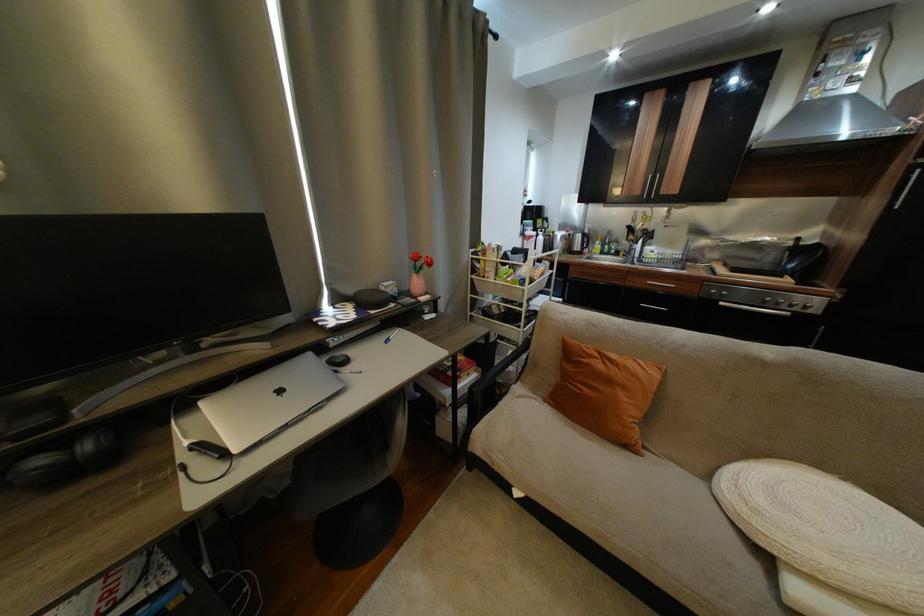
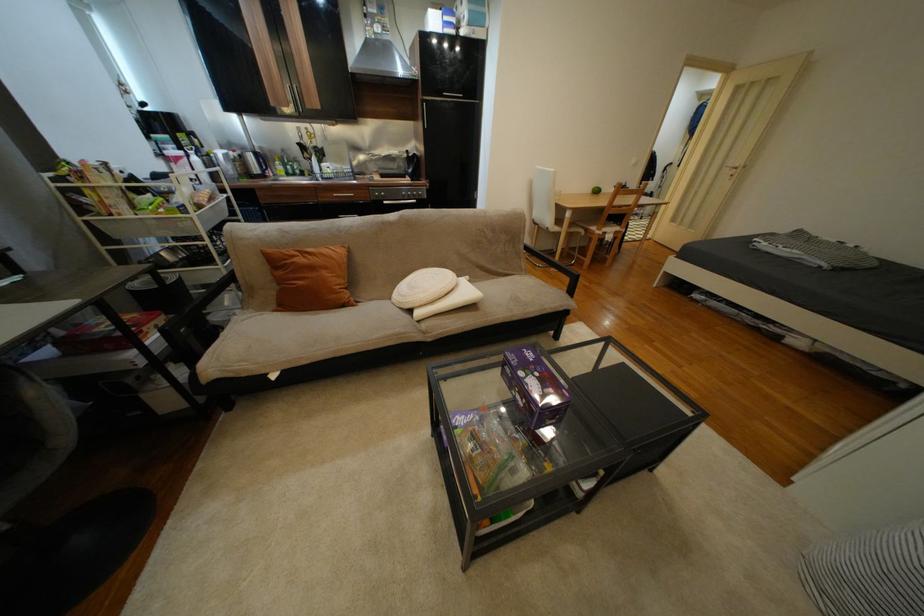
Locate, in the second image, the point that corresponds to point 551,403 in the first image.

(280, 314)